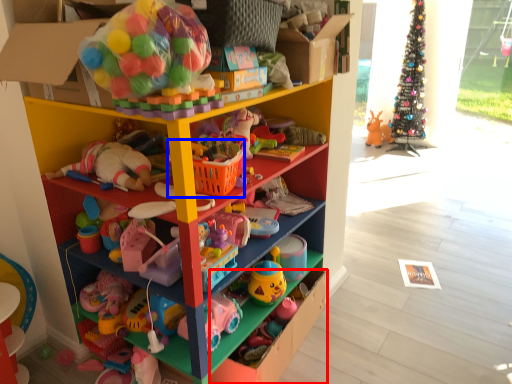
Question: Which of the following is the closest to the observer, drawer (highlighted by a red box) or basket (highlighted by a blue box)?

Choices:
 (A) drawer
 (B) basket

Answer: (B)